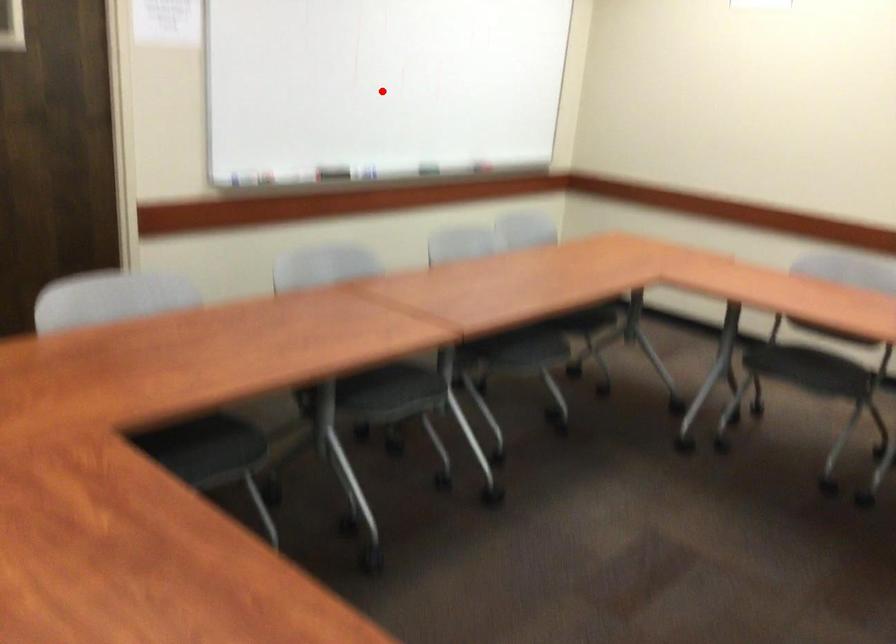
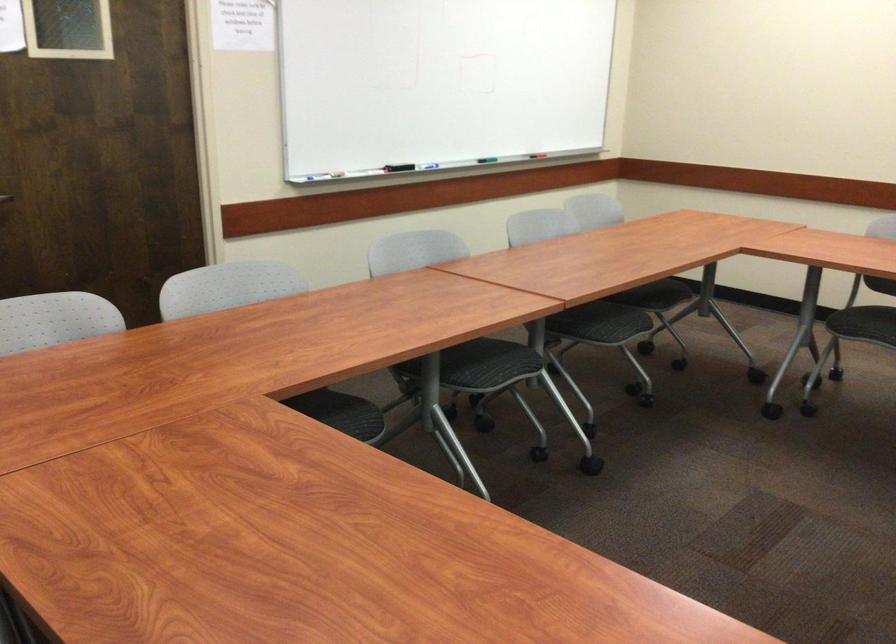
Locate, in the second image, the point that corresponds to the highlighted location in the first image.

(438, 82)